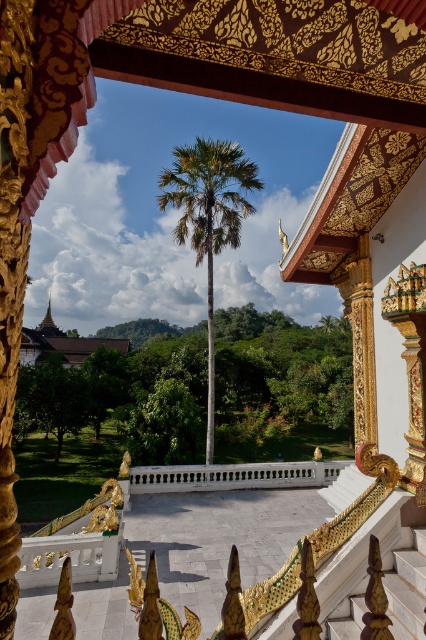
Who is shorter, green leafy palm at center or white marble balustrade at center?

With less height is white marble balustrade at center.

Who is higher up, green leafy palm at center or white marble balustrade at center?

green leafy palm at center

Find the location of a particular element. This screenshot has width=426, height=640. green leafy palm at center is located at coordinates (209, 218).